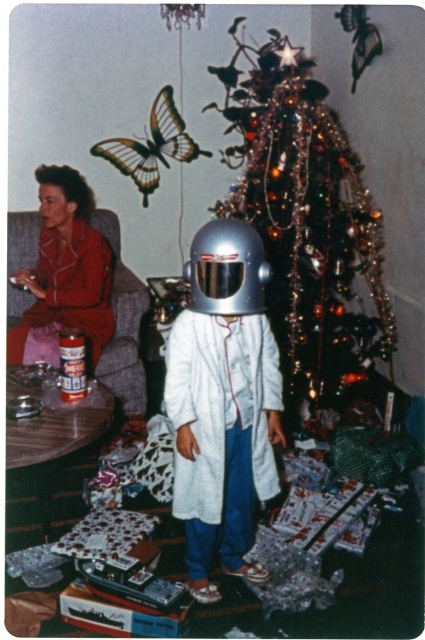
You are trying to place a small gift box that is 0.1 meters wide on the floor in front of the shiny silver helmet at center. Based on the coordinates provided, is there enough space to place the gift box without overlapping the helmet?

The shiny silver helmet at center is located at point (223, 403). Since the gift box is only 0.1 meters wide, there should be sufficient space on the floor in front of the helmet to place it without overlapping, assuming the coordinates allow for such placement.